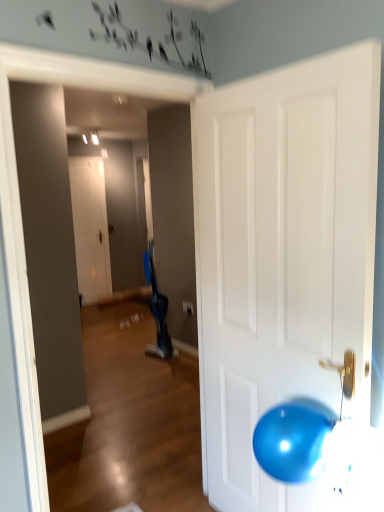
Question: From a real-world perspective, is white matte door at center, arranged as the second door when viewed from the right, positioned above or below glossy white door at right, the 1th door positioned from the front?

Choices:
 (A) below
 (B) above

Answer: (B)

Question: From the image's perspective, is white matte door at center, placed as the 1th door when sorted from left to right, located above or below glossy white door at right, the second door from the left?

Choices:
 (A) above
 (B) below

Answer: (A)

Question: Considering the positions of white matte door at center, arranged as the second door when viewed from the right, and glossy white door at right, the 1th door positioned from the front, in the image, is white matte door at center, arranged as the second door when viewed from the right, bigger or smaller than glossy white door at right, the 1th door positioned from the front,?

Choices:
 (A) big
 (B) small

Answer: (B)

Question: Is glossy white door at right, the second door from the left, wider or thinner than white matte door at center, arranged as the second door when viewed from the right?

Choices:
 (A) thin
 (B) wide

Answer: (B)

Question: Is glossy white door at right, which ranks as the first door in right-to-left order, spatially inside white matte door at center, which is the second door in front-to-back order, or outside of it?

Choices:
 (A) inside
 (B) outside

Answer: (B)

Question: From the image's perspective, relative to white matte door at center, the first door positioned from the back, is glossy white door at right, positioned as the 2th door in back-to-front order, above or below?

Choices:
 (A) below
 (B) above

Answer: (A)

Question: From a real-world perspective, relative to white matte door at center, placed as the 1th door when sorted from left to right, is glossy white door at right, the second door from the left, vertically above or below?

Choices:
 (A) above
 (B) below

Answer: (B)